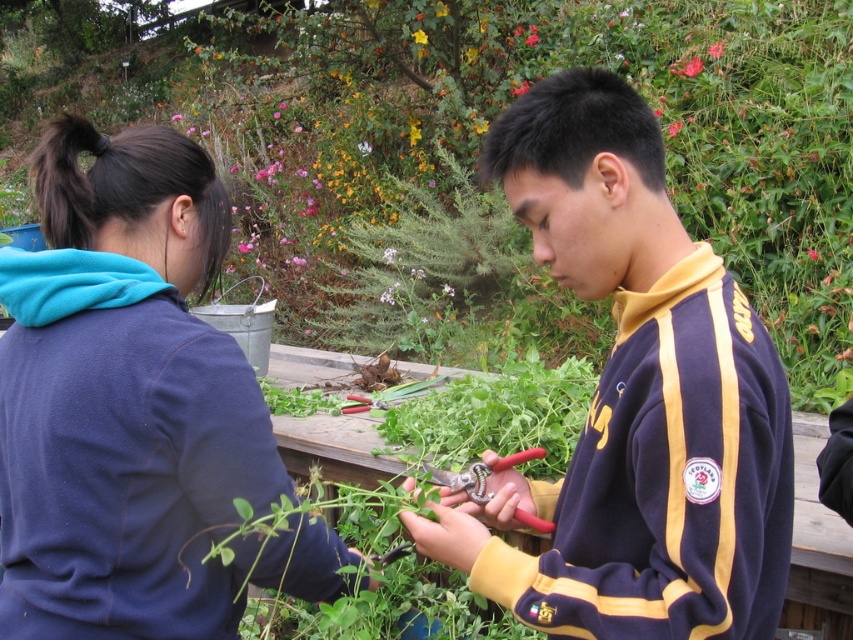
Is the position of purple/yellow sweatshirt at center more distant than that of glossy ceramic flower at upper center?

That is False.

Does purple/yellow sweatshirt at center have a lesser width compared to glossy ceramic flower at upper center?

No.

Which is in front, point (634, 620) or point (721, 40)?

Point (634, 620) is more forward.

This screenshot has width=853, height=640. What are the coordinates of `purple/yellow sweatshirt at center` in the screenshot? It's located at (634, 401).

Which is more to the left, dark blue fleece at upper left or glossy ceramic flower at upper center?

dark blue fleece at upper left is more to the left.

Can you confirm if dark blue fleece at upper left is positioned above glossy ceramic flower at upper center?

No.

I want to click on dark blue fleece at upper left, so click(x=125, y=401).

Is dark blue fleece at upper left to the right of purple/yellow sweatshirt at center from the viewer's perspective?

Incorrect, dark blue fleece at upper left is not on the right side of purple/yellow sweatshirt at center.

Can you confirm if dark blue fleece at upper left is thinner than purple/yellow sweatshirt at center?

No.

Between point (132, 602) and point (643, 419), which one is positioned behind?

The point (132, 602) is behind.

Find the location of a particular element. The width and height of the screenshot is (853, 640). dark blue fleece at upper left is located at coordinates (125, 401).